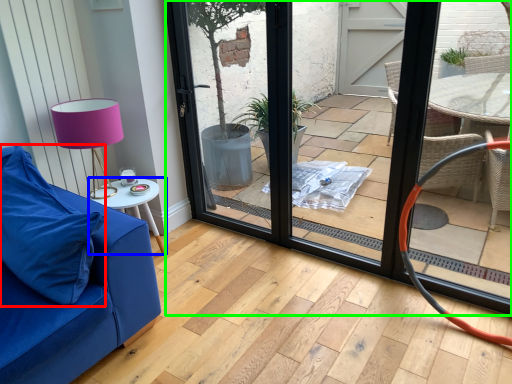
Question: Which object is the closest to the pillow (highlighted by a red box)? Choose among these: table (highlighted by a blue box) or door (highlighted by a green box).

Choices:
 (A) table
 (B) door

Answer: (A)